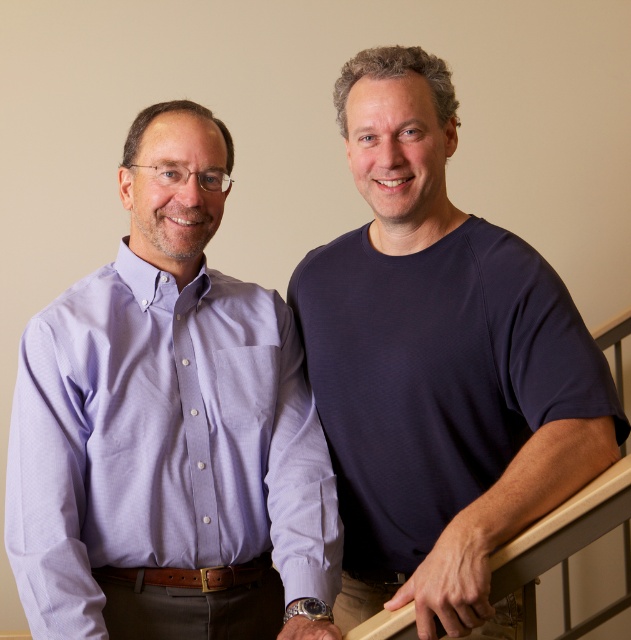
You are standing at the bottom of the staircase and see two points marked in the scene. Which point, point (156, 566) or point (408, 104), is closer to you?

Point (408, 104) is closer to you because it is in front of point (156, 566).